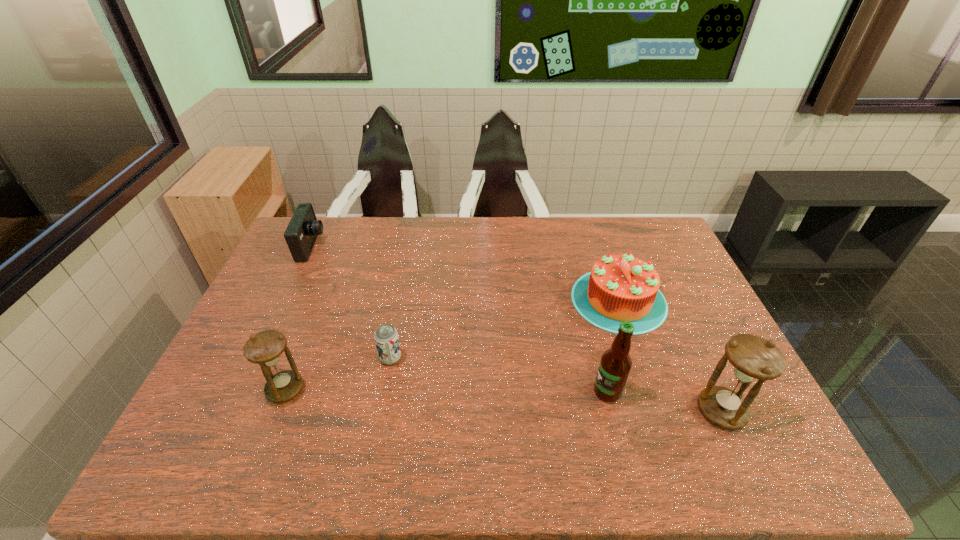
At what (x,y) coordinates should I click in order to perform the action: click on free space located on the left of the taller hourglass. Please return your answer as a coordinate pair (x, y). This screenshot has height=540, width=960. Looking at the image, I should click on (652, 411).

Image resolution: width=960 pixels, height=540 pixels. What are the coordinates of `free location located 0.320m on the front-facing side of the second shortest object` in the screenshot? It's located at click(414, 247).

This screenshot has height=540, width=960. I want to click on vacant space located 0.200m on the back of the cake, so click(596, 234).

Where is `vacant region located 0.120m on the back of the beer can`? The height and width of the screenshot is (540, 960). vacant region located 0.120m on the back of the beer can is located at coordinates (398, 318).

I want to click on free space located on the label of the beer bottle, so click(486, 392).

The image size is (960, 540). I want to click on free region located on the label of the beer bottle, so click(445, 392).

Find the location of `vacant space situated 0.160m on the label of the beer bottle`. vacant space situated 0.160m on the label of the beer bottle is located at coordinates 529,392.

You are a GUI agent. You are given a task and a screenshot of the screen. Output one action in this format:
    pyautogui.click(x=<x>, y=<y>)
    Task: Click on the object located at the far edge
    This screenshot has width=960, height=540.
    Given the screenshot: What is the action you would take?
    pyautogui.click(x=301, y=233)

Locate an element on the screen. beer bottle present at the near edge is located at coordinates (615, 364).

What are the coordinates of `hourglass that is at the left edge` in the screenshot? It's located at (265, 348).